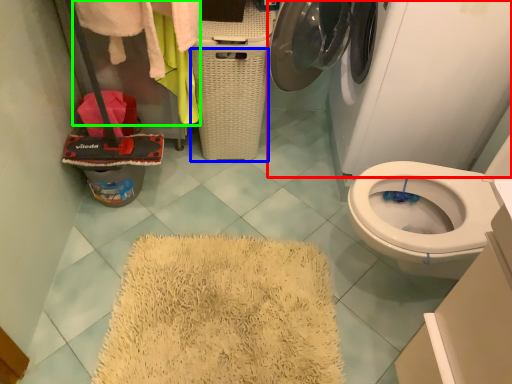
Question: Considering the real-world distances, which object is farthest from washing machine (highlighted by a red box)? basket (highlighted by a blue box) or clothing (highlighted by a green box)?

Choices:
 (A) basket
 (B) clothing

Answer: (B)